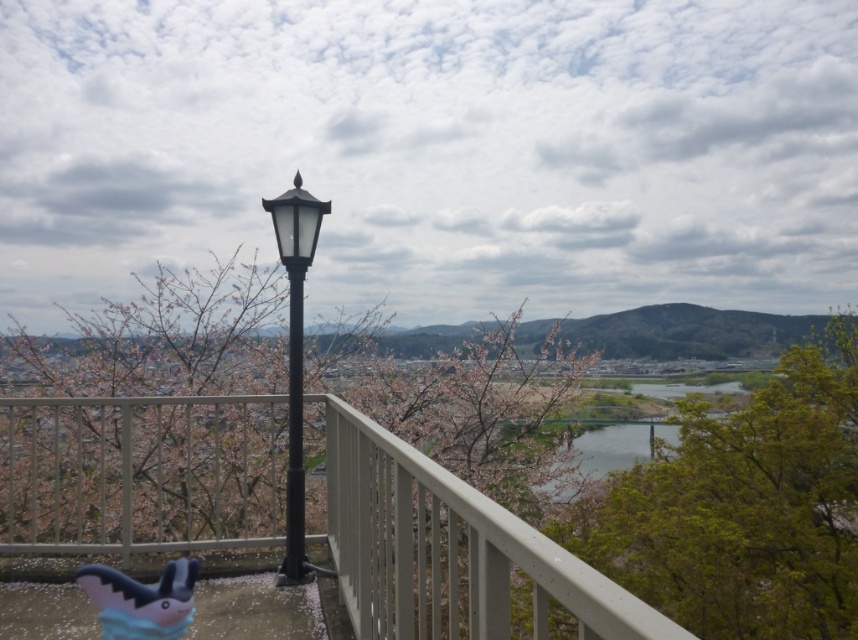
You are standing on the balcony and notice two black structures at the center. Which one is closer to you, the black matte lamp post at center or the black metal pole at center?

The black matte lamp post at center is positioned over the black metal pole at center, so the black matte lamp post at center is closer to you.

You are standing on the balcony and want to take a photo of the black matte lamp post at center. If your camera has a focal length of 50mm, what is the approximate distance in meters between you and the lamp post?

The distance of black matte lamp post at center from camera is 4.60 meters, so the camera is approximately 4.60 meters away from the black matte lamp post at center.